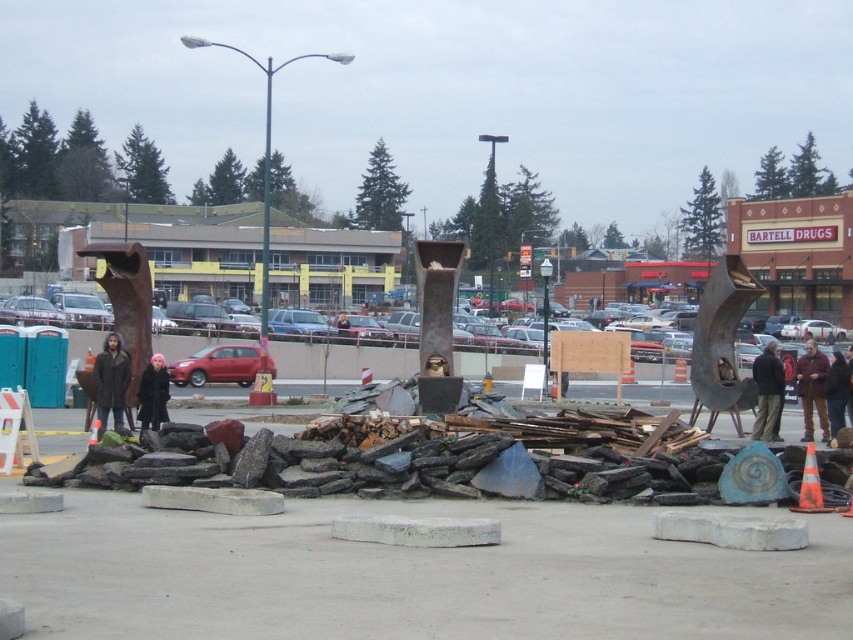
You are a delivery person who needs to place a large package on the ground without damaging the dark brown leather jacket at lower right. The package is the same size as the rusty metal parking lot at center. Where should you place the package?

The rusty metal parking lot at center is larger than the dark brown leather jacket at lower right, so you should place the package where the rusty metal parking lot at center is located to avoid damaging the smaller jacket.

Looking at this image, you are a delivery person trying to navigate through the construction site. You see the rusty metal parking lot at center and the dark brown leather jacket at lower right. Which object is taller, and can you safely step over it?

The rusty metal parking lot at center is taller than the dark brown leather jacket at lower right. Since the parking lot is taller, stepping over it may be difficult depending on its height. However, the jacket is shorter, so stepping over it should be easier.